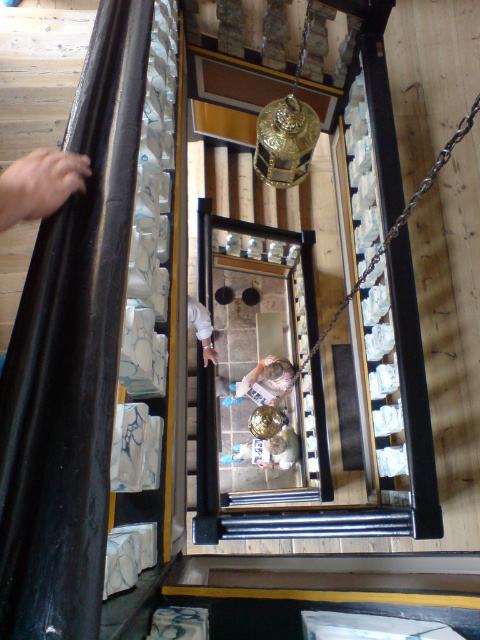
Question: Is smooth skin hand at upper left thinner than white fabric shirt at center?

Choices:
 (A) yes
 (B) no

Answer: (A)

Question: Is smooth skin hand at upper left behind white fabric at center?

Choices:
 (A) no
 (B) yes

Answer: (A)

Question: Which object appears farthest from the camera in this image?

Choices:
 (A) white fabric at center
 (B) white fabric shirt at center
 (C) light brown fabric shirt at center

Answer: (C)

Question: Among these points, which one is farthest from the camera?

Choices:
 (A) (14, 221)
 (B) (283, 449)
 (C) (242, 380)
 (D) (206, 326)

Answer: (C)

Question: Does light brown fabric shirt at center have a greater width compared to white fabric at center?

Choices:
 (A) no
 (B) yes

Answer: (B)

Question: Among these objects, which one is farthest from the camera?

Choices:
 (A) white fabric shirt at center
 (B) smooth skin hand at upper left
 (C) white fabric at center

Answer: (A)